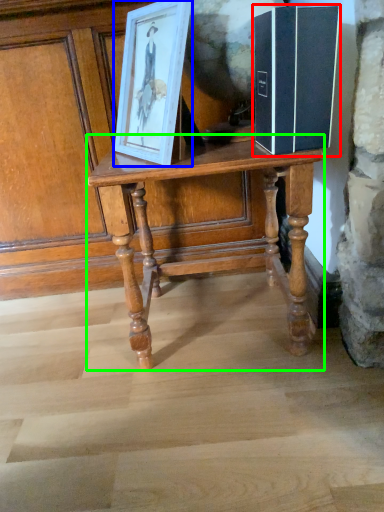
Question: Based on their relative distances, which object is farther from book (highlighted by a red box)? Choose from picture frame (highlighted by a blue box) and table (highlighted by a green box).

Choices:
 (A) picture frame
 (B) table

Answer: (B)